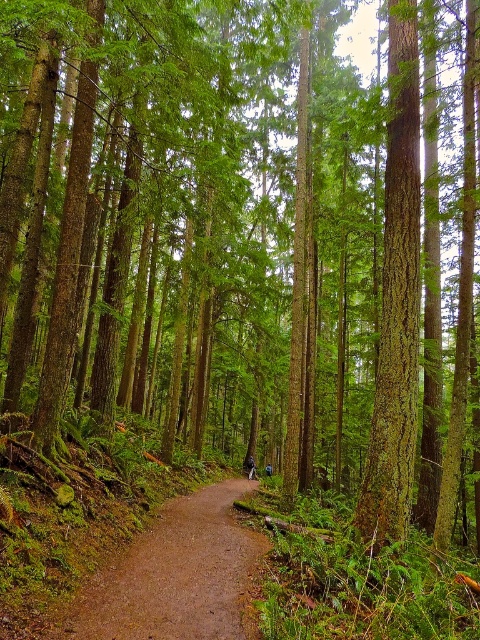
Question: Does dark blue jeans at center appear under blue fabric jacket at center?

Choices:
 (A) yes
 (B) no

Answer: (B)

Question: Which point is farther to the camera?

Choices:
 (A) (250, 467)
 (B) (227, 586)
 (C) (265, 474)
 (D) (409, 173)

Answer: (C)

Question: Does brown dirt path at center have a smaller size compared to dark blue jeans at center?

Choices:
 (A) no
 (B) yes

Answer: (A)

Question: Among these objects, which one is nearest to the camera?

Choices:
 (A) blue fabric jacket at center
 (B) green rough bark tree at center

Answer: (B)

Question: Is brown dirt path at center further to the viewer compared to dark blue jeans at center?

Choices:
 (A) yes
 (B) no

Answer: (B)

Question: Which point appears farthest from the camera in this image?

Choices:
 (A) (251, 477)
 (B) (268, 461)
 (C) (192, 504)

Answer: (B)